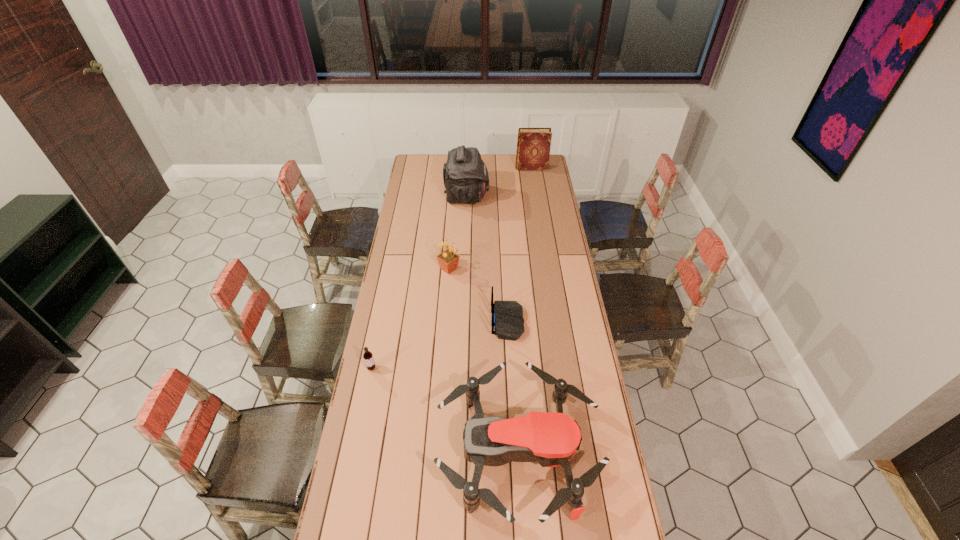
Identify the location of free space located on the back of the fourth farthest object. (463, 322).

Locate an element on the screen. free space located 0.070m on the back of the root beer is located at coordinates (375, 350).

Locate an element on the screen. This screenshot has height=540, width=960. object located at the far edge is located at coordinates (x=533, y=147).

Where is `object that is at the left edge`? The width and height of the screenshot is (960, 540). object that is at the left edge is located at coordinates (368, 356).

Locate an element on the screen. This screenshot has height=540, width=960. hardback book positioned at the right edge is located at coordinates (533, 147).

The image size is (960, 540). Identify the location of drone that is at the right edge. (552, 439).

Identify the location of object at the far right corner. (533, 147).

The image size is (960, 540). Identify the location of vacant space at the far edge of the desktop. (441, 164).

Locate an element on the screen. The width and height of the screenshot is (960, 540). vacant space at the left edge of the desktop is located at coordinates point(394,468).

Find the location of `vacant space at the right edge of the desktop`. vacant space at the right edge of the desktop is located at coordinates (526, 180).